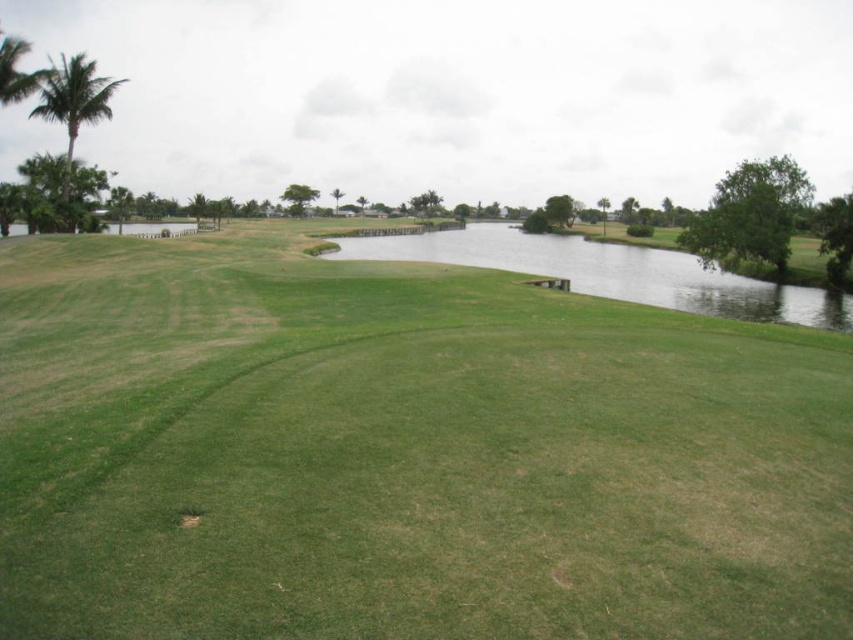
Question: Which point is farther from the camera taking this photo?

Choices:
 (A) (546, 465)
 (B) (73, 77)
 (C) (796, 314)

Answer: (B)

Question: Can you confirm if green grassy golf course at center is positioned to the right of green grassy lake at center?

Choices:
 (A) yes
 (B) no

Answer: (B)

Question: Does green grassy lake at center have a smaller size compared to green leafy palm tree at upper left?

Choices:
 (A) no
 (B) yes

Answer: (B)

Question: Does green grassy golf course at center have a greater width compared to green grassy lake at center?

Choices:
 (A) yes
 (B) no

Answer: (B)

Question: Which point is farther from the camera taking this photo?

Choices:
 (A) (637, 595)
 (B) (78, 99)
 (C) (427, 248)

Answer: (C)

Question: Which of the following is the closest to the observer?

Choices:
 (A) green grassy lake at center
 (B) green grassy golf course at center

Answer: (B)